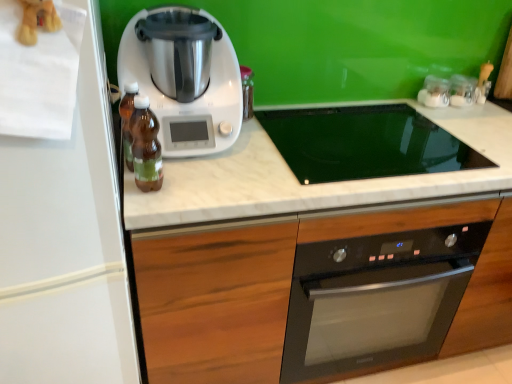
Where is `vacant area to the right of clear glass jars at upper right, the 2th appliance when ordered from right to left`? This screenshot has width=512, height=384. vacant area to the right of clear glass jars at upper right, the 2th appliance when ordered from right to left is located at coordinates (476, 110).